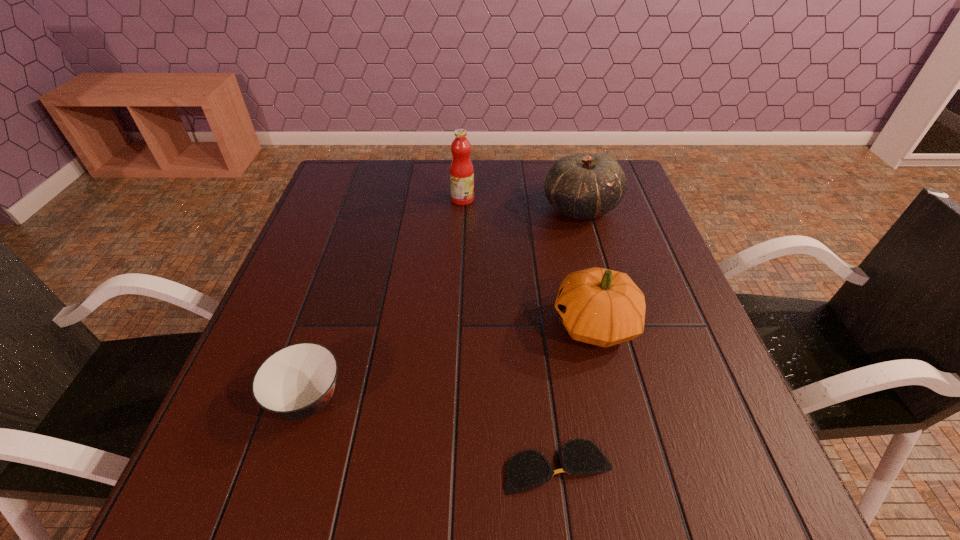
The height and width of the screenshot is (540, 960). Identify the location of blank area in the image that satisfies the following two spatial constraints: 1. on the front label of the fourth object from right to left; 2. on the left side of the shortest object. (449, 467).

This screenshot has height=540, width=960. I want to click on free point that satisfies the following two spatial constraints: 1. on the side of the third farthest object with the carved face; 2. on the front side of the fourth farthest object, so click(613, 400).